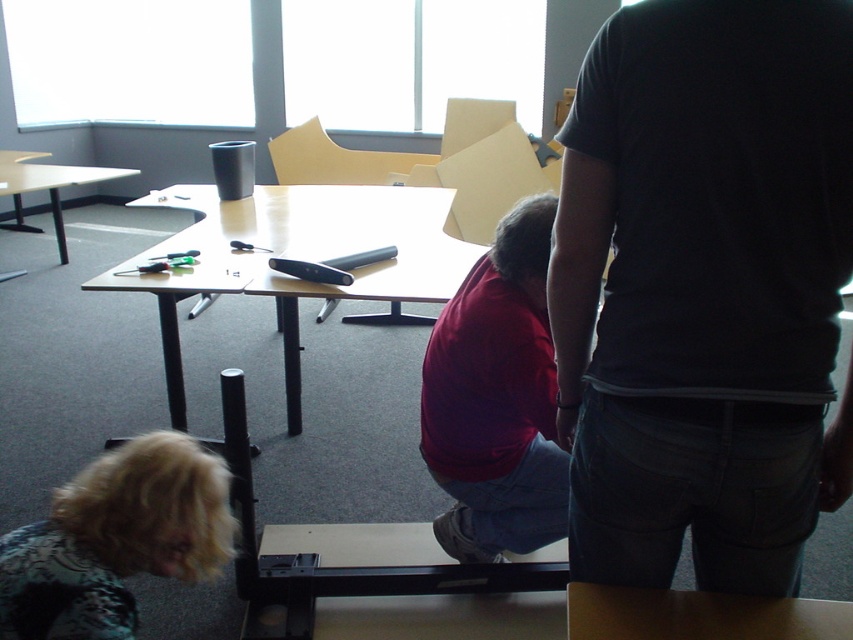
You are standing in the classroom and want to place a large textbook on the nearest table. Which table should you choose between the brown wooden table at lower center and the matte black table at left?

The brown wooden table at lower center is located below the matte black table at left, so it is closer to you. Therefore, you should choose the brown wooden table at lower center to place the textbook.